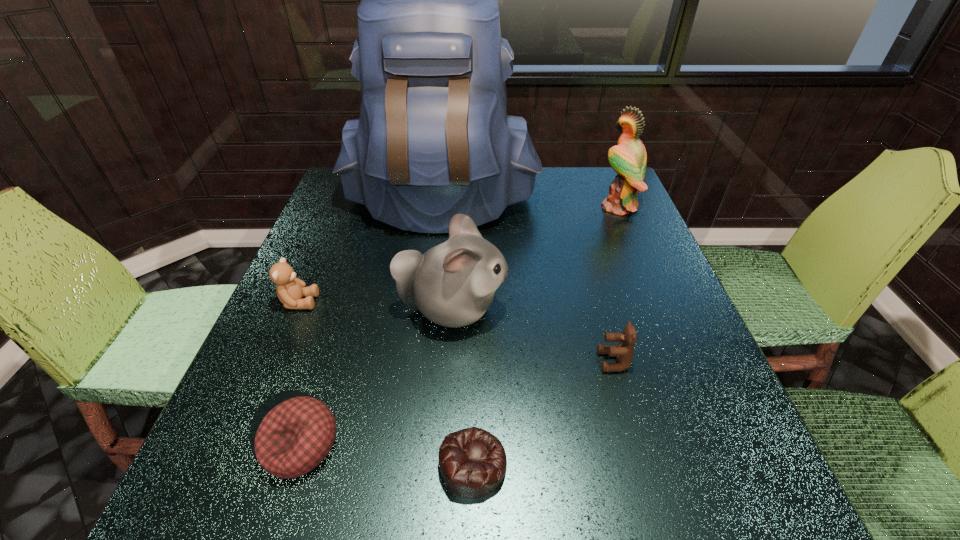
Image resolution: width=960 pixels, height=540 pixels. I want to click on vacant area that lies between the hamster and the shortest object, so click(x=463, y=387).

The width and height of the screenshot is (960, 540). I want to click on unoccupied position between the shortest object and the nearer teddy bear, so click(543, 413).

The width and height of the screenshot is (960, 540). I want to click on empty space that is in between the right teddy bear and the shorter beanbag, so click(543, 413).

Identify the location of unoccupied area between the rightmost object and the nearer teddy bear. (616, 284).

Identify the location of empty space that is in between the left teddy bear and the second shortest object. (300, 373).

Identify the location of free spot between the second shortest object and the fifth shortest object. Image resolution: width=960 pixels, height=540 pixels. (376, 377).

Identify which object is the fourth nearest to the nearer teddy bear. Please provide its 2D coordinates. Your answer should be formatted as a tuple, i.e. [(x, y)], where the tuple contains the x and y coordinates of a point satisfying the conditions above.

[(628, 158)]

Point out which object is positioned as the second nearest to the third nearest object. Please provide its 2D coordinates. Your answer should be formatted as a tuple, i.e. [(x, y)], where the tuple contains the x and y coordinates of a point satisfying the conditions above.

[(472, 461)]

Find the location of a particular element. Image resolution: width=960 pixels, height=540 pixels. free space that satisfies the following two spatial constraints: 1. at the front pocket of the shorter beanbag; 2. on the right side of the tallest object is located at coordinates (407, 464).

The image size is (960, 540). I want to click on free spot that satisfies the following two spatial constraints: 1. on the back side of the left beanbag; 2. on the face of the left teddy bear, so click(x=347, y=302).